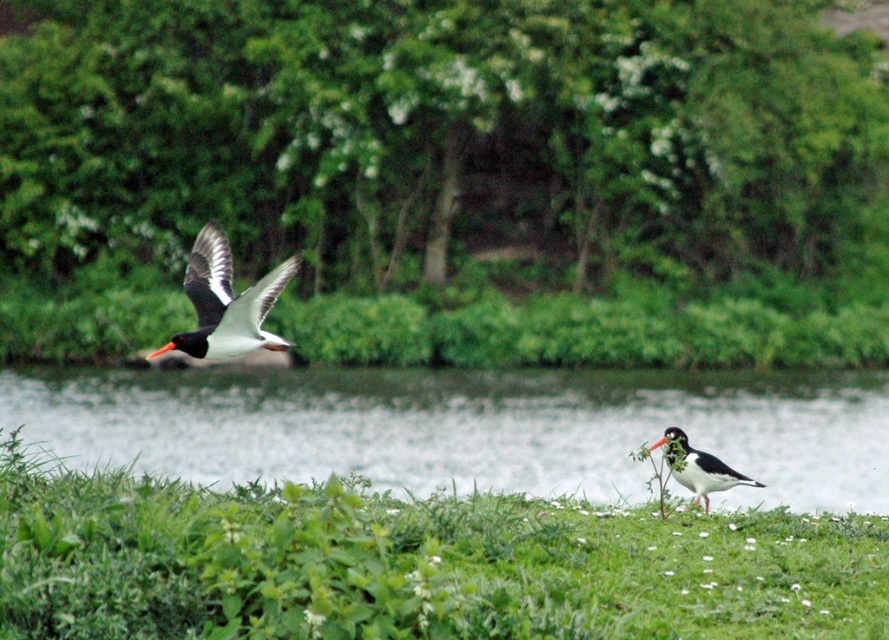
You are a birdwatcher trying to observe both birds in the scene. Given that your binoculars have a maximum effective range of 10 feet, can you clearly see both the black and white bird at upper left and the speckled white bird at lower right through them?

The distance between the black and white bird at upper left and the speckled white bird at lower right is 9.82 feet, which is within the 10 feet range of your binoculars. Therefore, you can clearly see both birds through them.

You are standing at the center of the grassy area and want to reach the clear water at grass right. Which direction should you walk to get there?

You should walk to the right to reach the clear water at grass right since it is located at the grassy area on the right side.